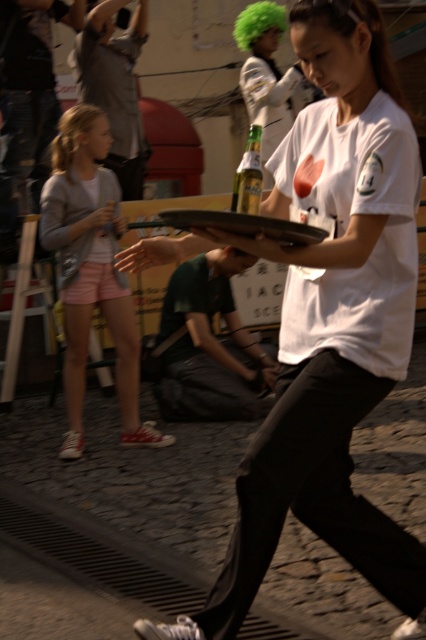
Question: Considering the real-world distances, which object is farthest from the gray cotton shirt at upper left?

Choices:
 (A) light pink denim shorts at left
 (B) green glass bottle at center
 (C) green wig at upper center

Answer: (C)

Question: Among these points, which one is farthest from the camera?

Choices:
 (A) (310, 67)
 (B) (239, 182)

Answer: (B)

Question: Can you confirm if light pink denim shorts at left is positioned below dark green fabric shirt at center?

Choices:
 (A) yes
 (B) no

Answer: (B)

Question: Does light pink denim shorts at left have a greater width compared to dark green fabric shirt at center?

Choices:
 (A) yes
 (B) no

Answer: (B)

Question: Can you confirm if light pink denim shorts at left is positioned above dark green fabric shirt at center?

Choices:
 (A) yes
 (B) no

Answer: (A)

Question: Which point is closer to the camera?

Choices:
 (A) (362, 536)
 (B) (249, 209)
 (C) (203, 326)

Answer: (B)